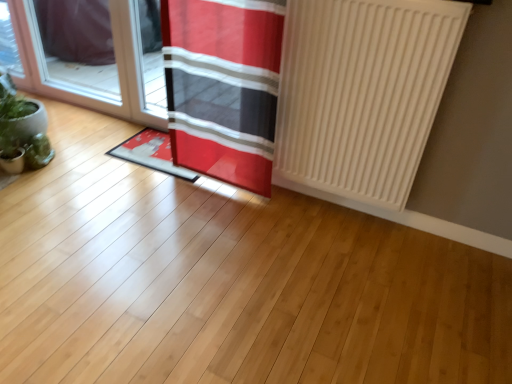
Describe the element at coordinates (151, 153) in the screenshot. This screenshot has width=512, height=384. I see `red fabric doormat at center` at that location.

Find the location of `red fabric doormat at center`. red fabric doormat at center is located at coordinates (151, 153).

Describe the element at coordinates (22, 130) in the screenshot. I see `green matte plant at left` at that location.

Where is `green matte plant at left`? green matte plant at left is located at coordinates (22, 130).

What do you see at coordinates (76, 85) in the screenshot?
I see `transparent glass door at left` at bounding box center [76, 85].

Measure the distance between transparent glass door at left and camera.

They are 2.33 meters apart.

The height and width of the screenshot is (384, 512). Describe the element at coordinates (223, 87) in the screenshot. I see `red fabric curtain at center` at that location.

At what (x,y) coordinates should I click in order to perform the action: click on white matte radiator at right. Please return your answer as a coordinate pair (x, y). This screenshot has height=384, width=512. Looking at the image, I should click on (362, 92).

Find the location of `red fabric doormat at center`. red fabric doormat at center is located at coordinates (151, 153).

Which object is closer to the camera taking this photo, green matte plant at left or red fabric curtain at center?

red fabric curtain at center.

Is green matte plant at left at the right side of red fabric curtain at center?

Incorrect, green matte plant at left is not on the right side of red fabric curtain at center.

From the image's perspective, is green matte plant at left above or below red fabric curtain at center?

green matte plant at left is situated lower than red fabric curtain at center in the image.

Which is in front, point (27, 162) or point (279, 28)?

The point (279, 28) is more forward.

Can you confirm if transparent glass door at left is smaller than green matte plant at left?

Incorrect, transparent glass door at left is not smaller in size than green matte plant at left.

Based on their positions, is transparent glass door at left located to the left or right of green matte plant at left?

Based on their positions, transparent glass door at left is located to the right of green matte plant at left.

From the image's perspective, is transparent glass door at left beneath green matte plant at left?

Actually, transparent glass door at left appears above green matte plant at left in the image.

In terms of height, does transparent glass door at left look taller or shorter compared to green matte plant at left?

In the image, transparent glass door at left appears to be taller than green matte plant at left.

Is point (131, 16) farther from viewer compared to point (172, 91)?

Yes, point (131, 16) is behind point (172, 91).

Is transparent glass door at left beside red fabric curtain at center?

No, transparent glass door at left is not next to red fabric curtain at center.

Considering the positions of objects transparent glass door at left and red fabric curtain at center in the image provided, who is more to the right, transparent glass door at left or red fabric curtain at center?

From the viewer's perspective, red fabric curtain at center appears more on the right side.

Which object is further away from the camera, transparent glass door at left or red fabric curtain at center?

transparent glass door at left is further away from the camera.

Is red fabric curtain at center a part of green matte plant at left?

Actually, red fabric curtain at center is outside green matte plant at left.

Which object is further away from the camera taking this photo, green matte plant at left or red fabric curtain at center?

green matte plant at left is further from the camera.

Which is farther from the camera, (5,128) or (265,85)?

The point (5,128) is farther.

From the image's perspective, which one is positioned lower, red fabric curtain at center or white matte radiator at right?

white matte radiator at right is shown below in the image.

Which is more to the right, red fabric curtain at center or white matte radiator at right?

white matte radiator at right.

Which object is further away from the camera taking this photo, red fabric curtain at center or white matte radiator at right?

red fabric curtain at center is behind.

Between point (175, 23) and point (402, 128), which one is positioned in front?

Point (402, 128)

From a real-world perspective, is white matte radiator at right physically located above or below red fabric curtain at center?

Clearly, from a real-world perspective, white matte radiator at right is above red fabric curtain at center.

Is white matte radiator at right inside the boundaries of red fabric curtain at center, or outside?

white matte radiator at right exists outside the volume of red fabric curtain at center.

Based on the photo, which is more to the left, white matte radiator at right or red fabric curtain at center?

red fabric curtain at center.

Is white matte radiator at right looking in the opposite direction of red fabric curtain at center?

That's not correct — white matte radiator at right is not looking away from red fabric curtain at center.

How many degrees apart are the facing directions of red fabric doormat at center and green matte plant at left?

There is a 5.22-degree angle between the facing directions of red fabric doormat at center and green matte plant at left.

The width and height of the screenshot is (512, 384). What are the coordinates of `houseplant above the red fabric doormat at center (from the image's perspective)` in the screenshot? It's located at (22, 130).

Considering the relative sizes of red fabric doormat at center and green matte plant at left in the image provided, is red fabric doormat at center taller than green matte plant at left?

No, red fabric doormat at center is not taller than green matte plant at left.

Which object is further away from the camera taking this photo, red fabric doormat at center or green matte plant at left?

red fabric doormat at center is further from the camera.

The width and height of the screenshot is (512, 384). I want to click on plant on the left of red fabric curtain at center, so point(38,152).

The height and width of the screenshot is (384, 512). In order to click on houseplant below the transparent glass door at left (from the image's perspective) in this screenshot , I will do `click(22, 130)`.

Consider the image. Considering their positions, is green matte plant at left positioned closer to red fabric curtain at center than transparent glass door at left?

Among the two, transparent glass door at left is located nearer to red fabric curtain at center.

From the image, which object appears to be nearer to red fabric curtain at center, red fabric doormat at center or green matte plant at left?

red fabric doormat at center is closer to red fabric curtain at center.

Which object lies nearer to the anchor point green matte plant at left, green matte plant at left or white matte radiator at right?

Among the two, green matte plant at left is located nearer to green matte plant at left.

Based on their spatial positions, is green matte plant at left or green matte plant at left closer to transparent glass door at left?

green matte plant at left lies closer to transparent glass door at left than the other object.

Which object lies further to the anchor point red fabric curtain at center, green matte plant at left or red fabric doormat at center?

Based on the image, green matte plant at left appears to be further to red fabric curtain at center.

Based on their spatial positions, is red fabric doormat at center or white matte radiator at right closer to transparent glass door at left?

red fabric doormat at center is positioned closer to the anchor transparent glass door at left.

Considering their positions, is green matte plant at left positioned further to transparent glass door at left than white matte radiator at right?

white matte radiator at right.

Considering their positions, is transparent glass door at left positioned further to red fabric curtain at center than green matte plant at left?

green matte plant at left lies further to red fabric curtain at center than the other object.

Where is `plant between green matte plant at left and white matte radiator at right from left to right`? The width and height of the screenshot is (512, 384). plant between green matte plant at left and white matte radiator at right from left to right is located at coordinates tap(38, 152).

This screenshot has height=384, width=512. I want to click on doormat situated between transparent glass door at left and red fabric curtain at center from left to right, so click(151, 153).

This screenshot has height=384, width=512. I want to click on houseplant between transparent glass door at left and green matte plant at left vertically, so click(22, 130).

Where is `curtain situated between green matte plant at left and white matte radiator at right from left to right`? curtain situated between green matte plant at left and white matte radiator at right from left to right is located at coordinates (223, 87).